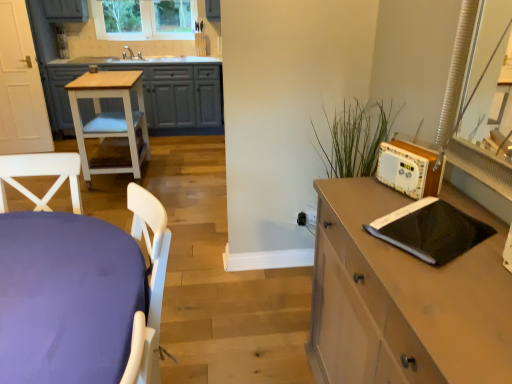
Question: Does wooden radio at right have a greater width compared to black matte notebook at right?

Choices:
 (A) no
 (B) yes

Answer: (A)

Question: Considering the relative sizes of wooden radio at right and black matte notebook at right in the image provided, is wooden radio at right shorter than black matte notebook at right?

Choices:
 (A) yes
 (B) no

Answer: (B)

Question: Is wooden radio at right facing away from black matte notebook at right?

Choices:
 (A) no
 (B) yes

Answer: (A)

Question: Does wooden radio at right have a larger size compared to black matte notebook at right?

Choices:
 (A) no
 (B) yes

Answer: (B)

Question: Is black matte notebook at right surrounded by wooden radio at right?

Choices:
 (A) no
 (B) yes

Answer: (A)

Question: Looking at the image, does black matte notebook at right seem bigger or smaller compared to matte brown cabinet at right?

Choices:
 (A) small
 (B) big

Answer: (A)

Question: From a real-world perspective, is black matte notebook at right above or below matte brown cabinet at right?

Choices:
 (A) above
 (B) below

Answer: (A)

Question: In terms of width, does black matte notebook at right look wider or thinner when compared to matte brown cabinet at right?

Choices:
 (A) wide
 (B) thin

Answer: (B)

Question: Is black matte notebook at right situated inside matte brown cabinet at right or outside?

Choices:
 (A) inside
 (B) outside

Answer: (B)

Question: From the image's perspective, is matte brown cabinet at right located above or below wooden radio at right?

Choices:
 (A) below
 (B) above

Answer: (A)

Question: Which is correct: matte brown cabinet at right is inside wooden radio at right, or outside of it?

Choices:
 (A) inside
 (B) outside

Answer: (B)

Question: In terms of size, does matte brown cabinet at right appear bigger or smaller than wooden radio at right?

Choices:
 (A) big
 (B) small

Answer: (A)

Question: Considering the positions of matte brown cabinet at right and wooden radio at right in the image, is matte brown cabinet at right wider or thinner than wooden radio at right?

Choices:
 (A) wide
 (B) thin

Answer: (A)

Question: Visually, is white painted wood cabinet at left positioned to the left or to the right of clear glass window at upper center?

Choices:
 (A) left
 (B) right

Answer: (A)

Question: Is white painted wood cabinet at left taller or shorter than clear glass window at upper center?

Choices:
 (A) short
 (B) tall

Answer: (B)